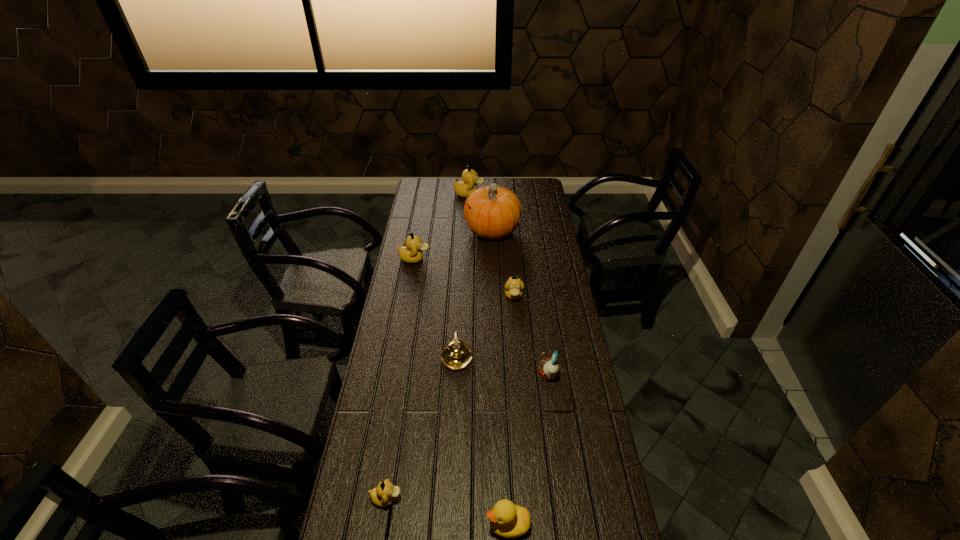
Locate an element on the screen. The width and height of the screenshot is (960, 540). the seventh nearest object is located at coordinates click(495, 212).

In order to click on pumpkin in this screenshot , I will do `click(495, 212)`.

Locate an element on the screen. This screenshot has width=960, height=540. the seventh shortest object is located at coordinates (464, 188).

Image resolution: width=960 pixels, height=540 pixels. What are the coordinates of `the third tan duckling from left to right` in the screenshot? It's located at (464, 188).

You are a GUI agent. You are given a task and a screenshot of the screen. Output one action in this format:
    pyautogui.click(x=<x>, y=<y>)
    Task: Click on the sixth nearest object
    
    Given the screenshot: What is the action you would take?
    click(x=411, y=253)

You are a GUI agent. You are given a task and a screenshot of the screen. Output one action in this format:
    pyautogui.click(x=<x>, y=<y>)
    Task: Click on the fourth nearest duckling
    
    Given the screenshot: What is the action you would take?
    pyautogui.click(x=411, y=253)

Find the location of `candle holder`. candle holder is located at coordinates (457, 354).

Image resolution: width=960 pixels, height=540 pixels. What are the coordinates of `the fourth farthest object` in the screenshot? It's located at (514, 286).

I want to click on the second nearest tan duckling, so click(x=514, y=286).

What are the coordinates of `muffin` in the screenshot? It's located at (549, 368).